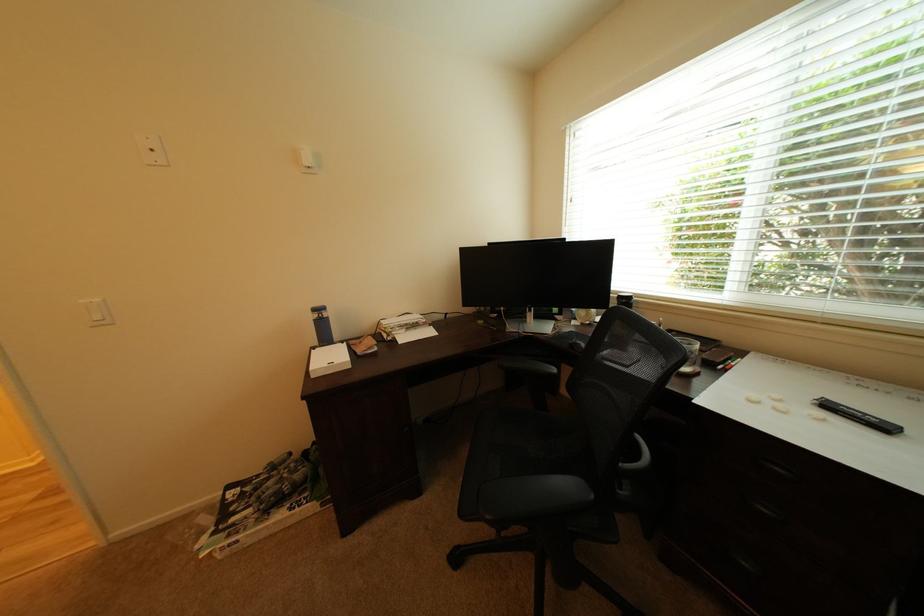
Which object does [858,416] point to?

It refers to a black marker.